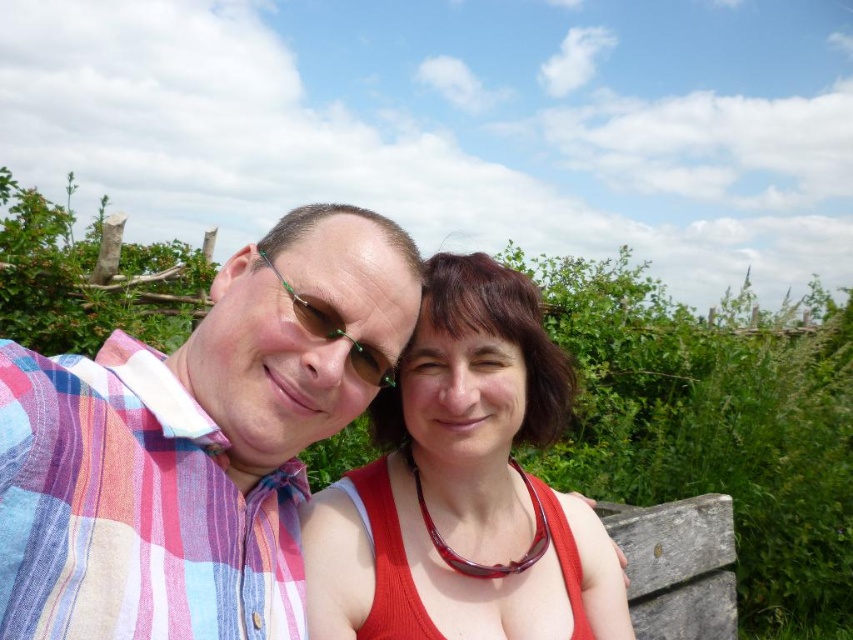
Between plaid shirt at left and green reflective sunglasses at center, which one has less height?

Standing shorter between the two is green reflective sunglasses at center.

Is plaid shirt at left closer to the viewer compared to green reflective sunglasses at center?

Yes, it is in front of green reflective sunglasses at center.

Measure the distance between point (350,259) and camera.

Point (350,259) and camera are 3.36 feet apart.

The height and width of the screenshot is (640, 853). Identify the location of plaid shirt at left. (196, 444).

Who is more forward, (x=453, y=621) or (x=372, y=371)?

Point (x=372, y=371) is in front.

Is matte red tank top at center positioned behind green reflective sunglasses at center?

Yes, it is behind green reflective sunglasses at center.

Who is more forward, [413,445] or [317,336]?

Positioned in front is point [317,336].

You are a GUI agent. You are given a task and a screenshot of the screen. Output one action in this format:
    pyautogui.click(x=<x>, y=<y>)
    Task: Click on the matte red tank top at center
    
    Given the screenshot: What is the action you would take?
    pyautogui.click(x=459, y=483)

Between plaid shirt at left and matte red tank top at center, which one has more height?

With more height is matte red tank top at center.

Is the position of plaid shirt at left more distant than that of matte red tank top at center?

No, plaid shirt at left is closer to the viewer.

Find the location of a particular element. Image resolution: width=853 pixels, height=640 pixels. plaid shirt at left is located at coordinates (196, 444).